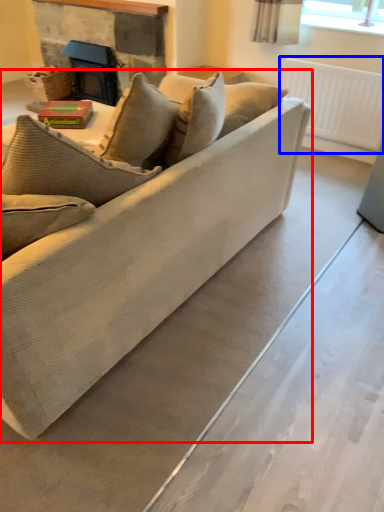
Question: Among these objects, which one is farthest to the camera, studio couch (highlighted by a red box) or radiator (highlighted by a blue box)?

Choices:
 (A) studio couch
 (B) radiator

Answer: (B)